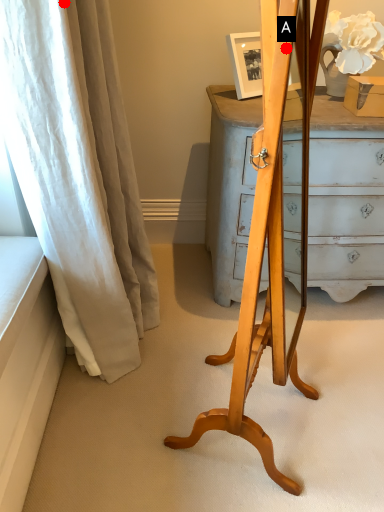
Question: Two points are circled on the image, labeled by A and B beside each circle. Which point is farther to the camera?

Choices:
 (A) A is further
 (B) B is further

Answer: (B)